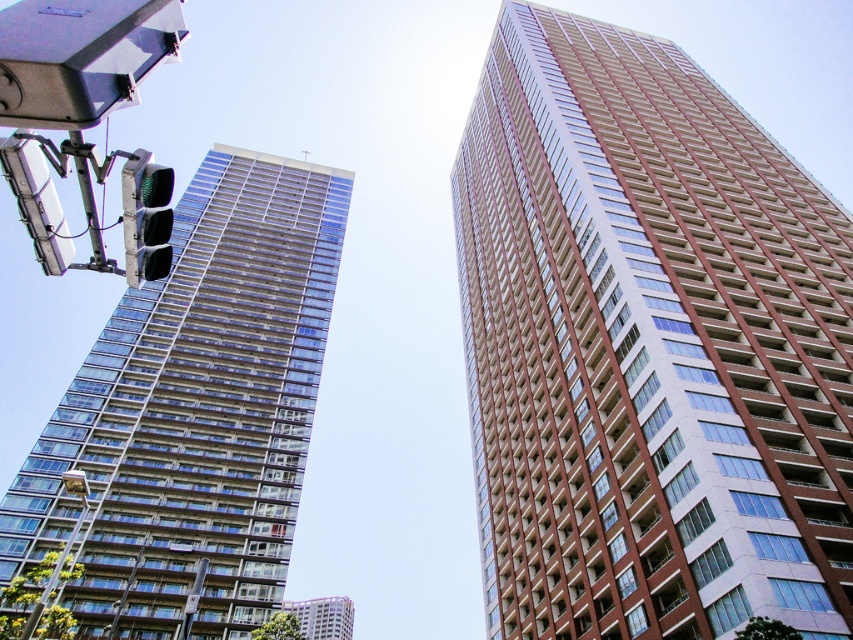
You are a pedestrian standing at the crosswalk and see the clear glass building at left and the metallic traffic light at left. Which object is positioned further to the left?

The clear glass building at left is positioned further to the left than the metallic traffic light at left.